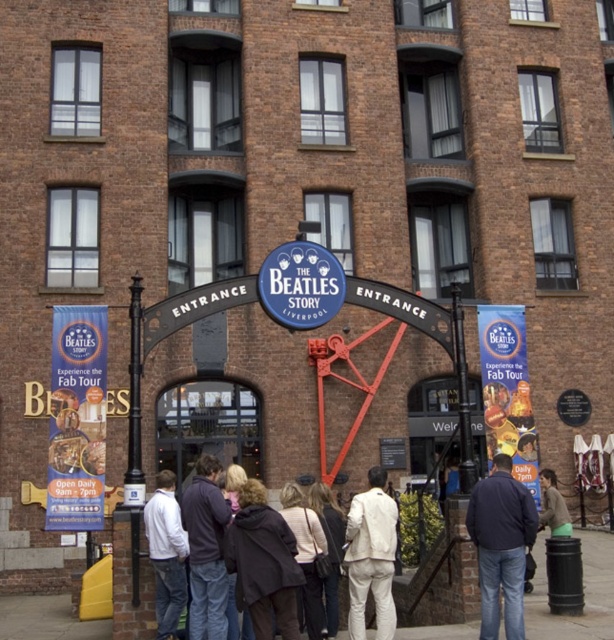
You are standing at the entrance of The Beatles Story. There is a point marked at coordinates (76, 419). What object is located at this point?

The point at coordinates (76, 419) marks the blue fabric banner at entrance.

What is located at the point with coordinates (195, 548) in the image of The Beatles Story entrance?

The point at coordinates (195, 548) corresponds to the white cotton jacket at center.

You are a visitor standing at the entrance of The Beatles Story. You see two jackets displayed at center. Which jacket is nearer to you, the white cotton jacket at center or the white matte jacket at center?

The white cotton jacket at center is closer to the viewer than the white matte jacket at center, so the white cotton jacket at center is nearer to you.